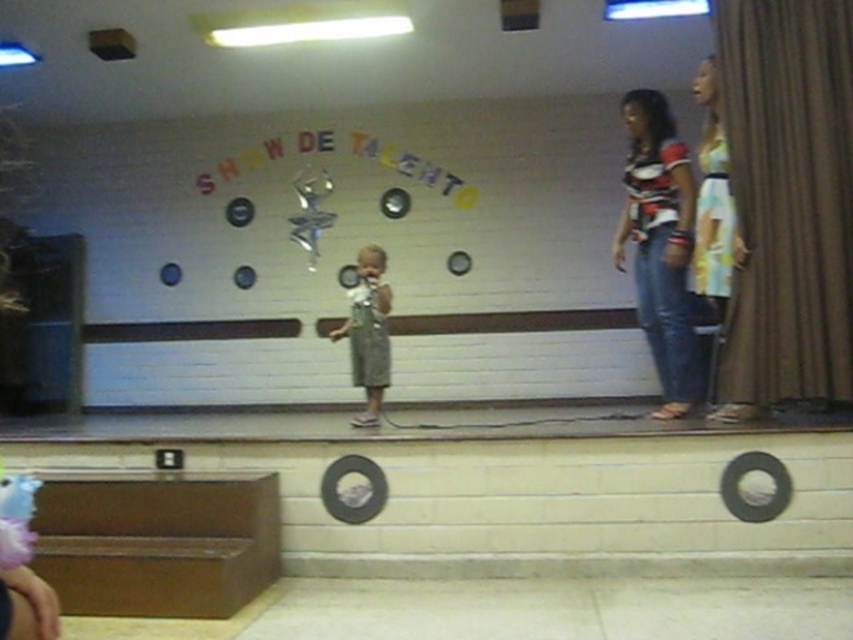
How much distance is there between striped fabric shirt at right and yellow floral dress at right?

striped fabric shirt at right and yellow floral dress at right are 7.99 inches apart.

Image resolution: width=853 pixels, height=640 pixels. What do you see at coordinates (659, 241) in the screenshot?
I see `striped fabric shirt at right` at bounding box center [659, 241].

Is point (682, 301) positioned behind point (695, 284)?

Yes, it is.

The width and height of the screenshot is (853, 640). In order to click on striped fabric shirt at right in this screenshot , I will do `click(659, 241)`.

Does striped fabric shirt at right lie behind green fabric dress at center?

No, striped fabric shirt at right is closer to the viewer.

Consider the image. Does striped fabric shirt at right have a lesser height compared to green fabric dress at center?

In fact, striped fabric shirt at right may be taller than green fabric dress at center.

Between point (639, 300) and point (368, 300), which one is positioned behind?

The point (368, 300) is behind.

Where is `striped fabric shirt at right`? striped fabric shirt at right is located at coordinates (659, 241).

Can you confirm if yellow floral dress at right is positioned to the right of green fabric dress at center?

Indeed, yellow floral dress at right is positioned on the right side of green fabric dress at center.

Can you confirm if yellow floral dress at right is positioned above green fabric dress at center?

Indeed, yellow floral dress at right is positioned over green fabric dress at center.

This screenshot has width=853, height=640. Identify the location of yellow floral dress at right. (712, 212).